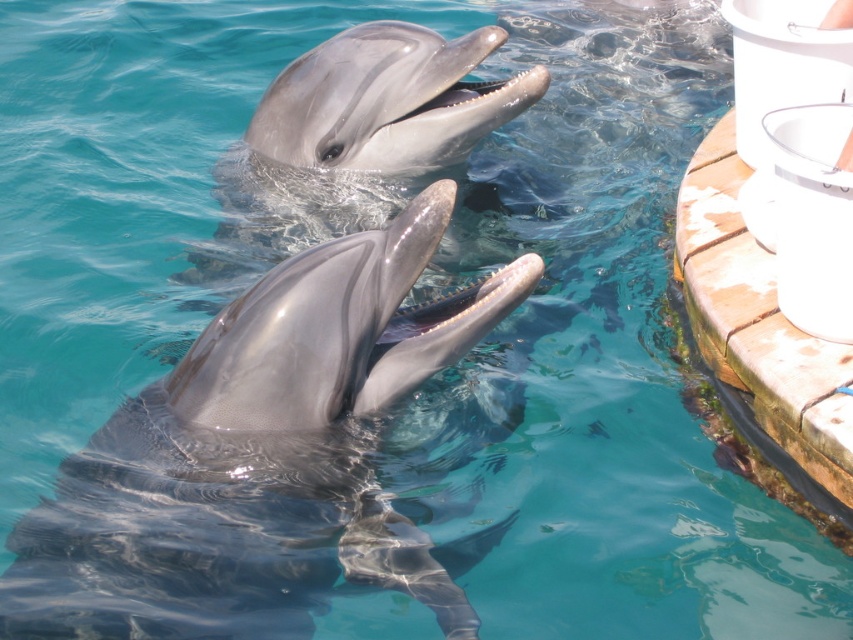
You are a marine biologist measuring the space between two dolphins for a study. The minimum safe distance for observing dolphins without disturbing them is 2 meters. Based on the scene, can you determine if the distance between the glossy gray dolphin at center and the shiny gray dolphin at upper center meets the safety requirement?

The distance between the glossy gray dolphin at center and the shiny gray dolphin at upper center is 1.52 meters, which is less than the required 2 meters. Therefore, the safety requirement is not met.

You are a marine biologist observing two dolphins in the water. You notice the glossy gray dolphin at center and the shiny gray dolphin at upper center. Which dolphin is located below the other?

The glossy gray dolphin at center is positioned under the shiny gray dolphin at upper center, so it is located below the other.

You are a marine biologist observing two dolphins in the water. You notice the glossy gray dolphin at center and the shiny gray dolphin at upper center. Which dolphin is positioned to the right of the other?

The glossy gray dolphin at center is positioned to the right of the shiny gray dolphin at upper center.